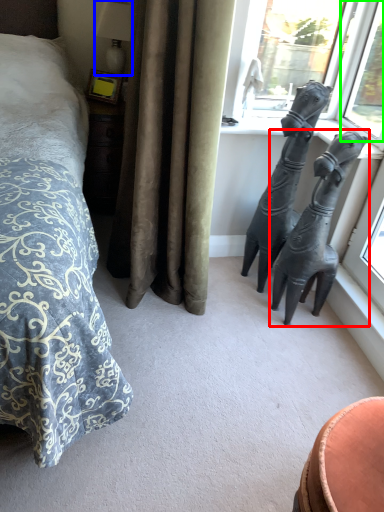
Question: Which object is the closest to the statue (sculpture) (highlighted by a red box)? Choose among these: lamp (highlighted by a blue box) or window (highlighted by a green box).

Choices:
 (A) lamp
 (B) window

Answer: (B)